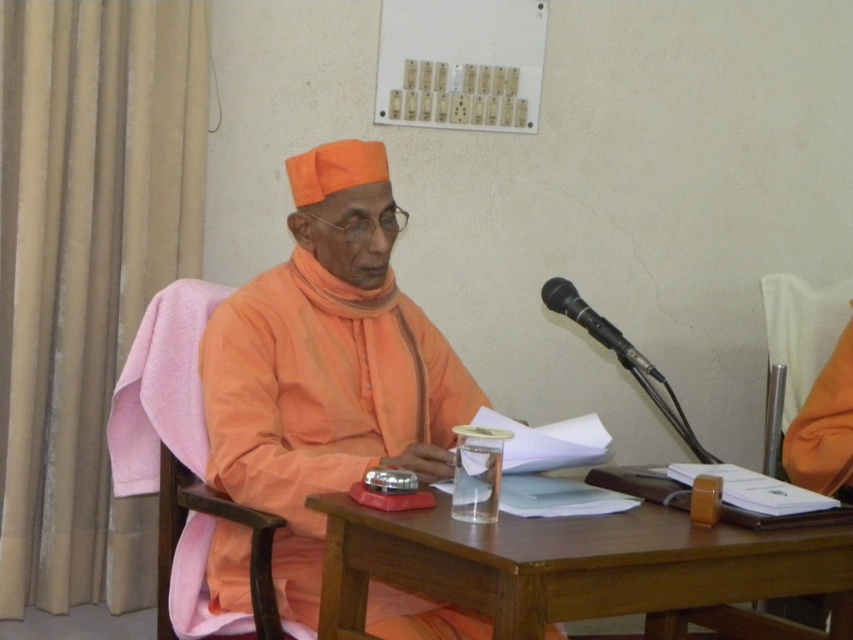
Does brown wooden table at center come in front of black metallic microphone at right?

Yes, it is.

Is brown wooden table at center bigger than black metallic microphone at right?

Yes.

Which is in front, point (474, 564) or point (601, 342)?

Point (474, 564)

At what (x,y) coordinates should I click in order to perform the action: click on brown wooden table at center. Please return your answer as a coordinate pair (x, y). This screenshot has width=853, height=640. Looking at the image, I should click on (572, 566).

What do you see at coordinates (328, 365) in the screenshot? I see `matte orange robe at center` at bounding box center [328, 365].

Does matte orange robe at center have a greater width compared to black metallic microphone at right?

Yes.

Find the location of a particular element. matte orange robe at center is located at coordinates (328, 365).

Can you confirm if brown wooden table at center is positioned below orange fabric chair at right?

Yes, brown wooden table at center is below orange fabric chair at right.

Can you confirm if brown wooden table at center is positioned above orange fabric chair at right?

No, brown wooden table at center is not above orange fabric chair at right.

Between point (527, 608) and point (828, 362), which one is positioned behind?

The point (828, 362) is behind.

Where is `brown wooden table at center`? Image resolution: width=853 pixels, height=640 pixels. brown wooden table at center is located at coordinates (572, 566).